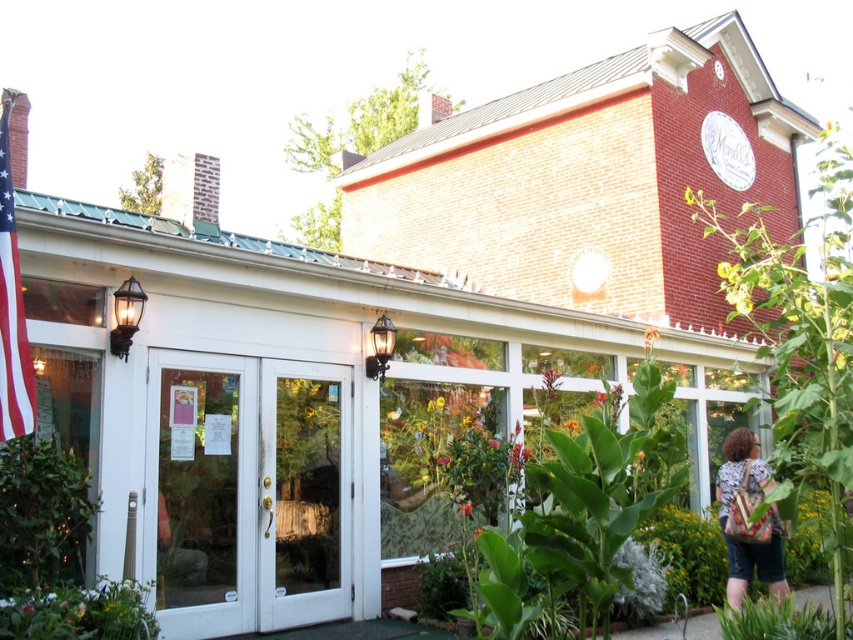
Question: Estimate the real-world distances between objects in this image. Which object is closer to the green leafy plant at left?

Choices:
 (A) patterned fabric bag at right
 (B) green leafy plant at center
 (C) red fabric flag at left

Answer: (C)

Question: Does white glass door at center have a greater width compared to red fabric flag at left?

Choices:
 (A) yes
 (B) no

Answer: (A)

Question: Which of the following is the farthest from the observer?

Choices:
 (A) (62, 522)
 (B) (770, 592)

Answer: (B)

Question: Estimate the real-world distances between objects in this image. Which object is farther from the red fabric flag at left?

Choices:
 (A) green leafy plant at center
 (B) white glass door at center

Answer: (A)

Question: Observing the image, what is the correct spatial positioning of patterned fabric bag at right in reference to green leafy plant at center?

Choices:
 (A) right
 (B) left

Answer: (A)

Question: Does red fabric flag at left have a smaller size compared to green leafy plant at center?

Choices:
 (A) no
 (B) yes

Answer: (A)